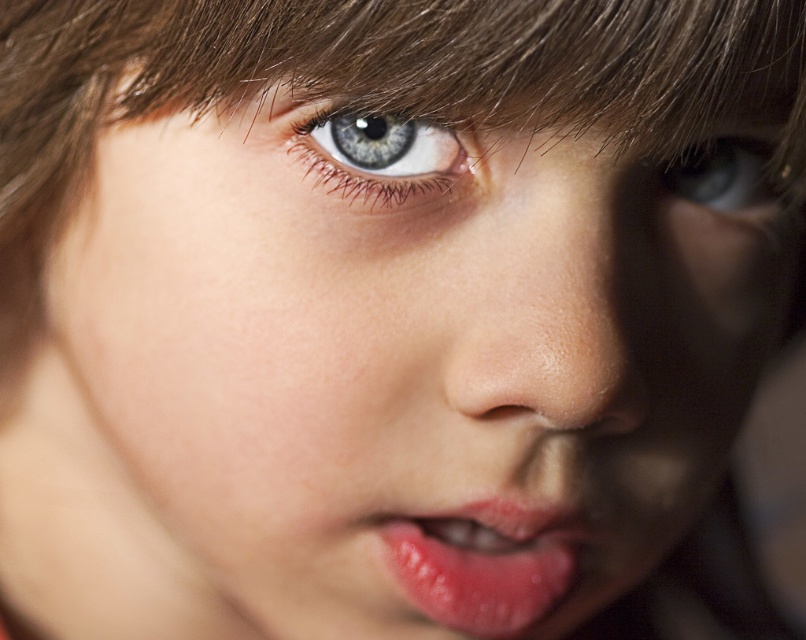
Who is taller, glossy pink lips at center or blue glossy eye at upper right?

glossy pink lips at center

Is glossy pink lips at center bigger than blue glossy eye at upper right?

Yes.

I want to click on glossy pink lips at center, so click(483, 563).

Is blue glossy eye at center positioned before blue glossy eye at upper right?

Yes, it is in front of blue glossy eye at upper right.

Between point (410, 163) and point (758, 141), which one is positioned in front?

Point (410, 163)

Does point (403, 189) come behind point (733, 140)?

No, it is not.

The height and width of the screenshot is (640, 806). Identify the location of blue glossy eye at center. (379, 154).

Which is below, smooth skin nose at center or blue glossy eye at center?

smooth skin nose at center is below.

From the picture: Does smooth skin nose at center have a greater height compared to blue glossy eye at center?

Indeed, smooth skin nose at center has a greater height compared to blue glossy eye at center.

Locate an element on the screen. Image resolution: width=806 pixels, height=640 pixels. smooth skin nose at center is located at coordinates (541, 300).